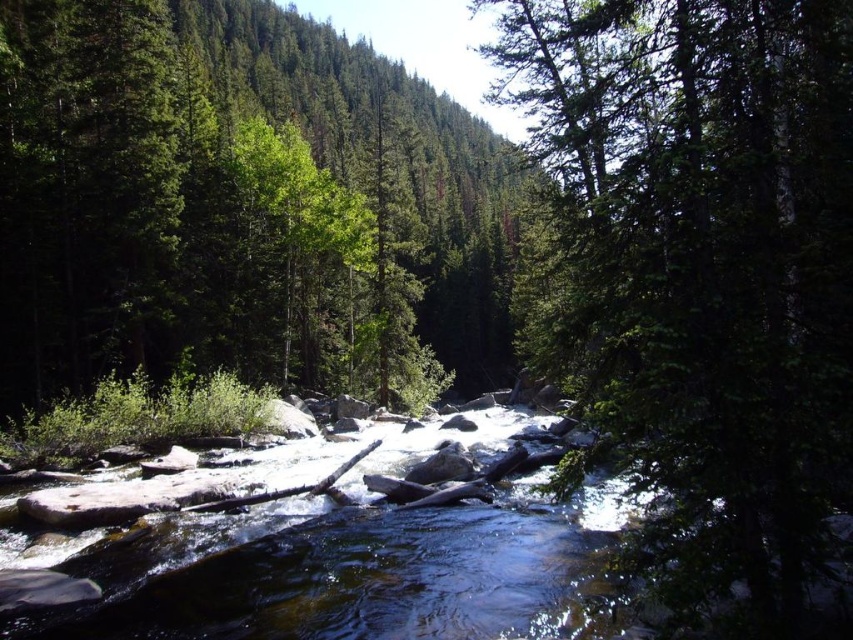
You are a hiker standing at the riverbank and want to take a photo of both the green textured tree at center and the green matte tree at upper center. Which tree should you focus on first to ensure both are in clear view?

You should focus on the green textured tree at center first because it is closer to you than the green matte tree at upper center, so adjusting focus from near to far will help both be in clear view.

You are standing at the riverbank in the forest scene. You see two points marked in the image. The first point is at coordinates point (811, 76) and the second is at point (350, 120). Which point is closer to you?

Point (811, 76) is closer to you because it is in front of point (350, 120).